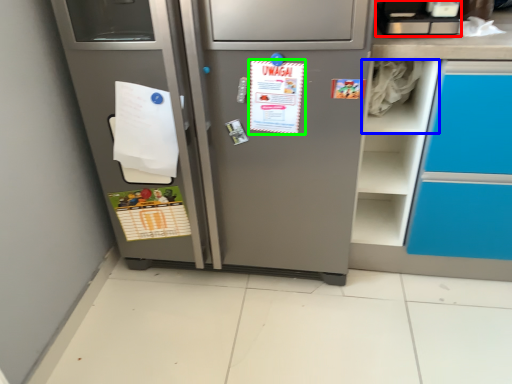
Question: Estimate the real-world distances between objects in this image. Which object is farther from appliance (highlighted by a red box), shelf (highlighted by a blue box) or postcard (highlighted by a green box)?

Choices:
 (A) shelf
 (B) postcard

Answer: (B)